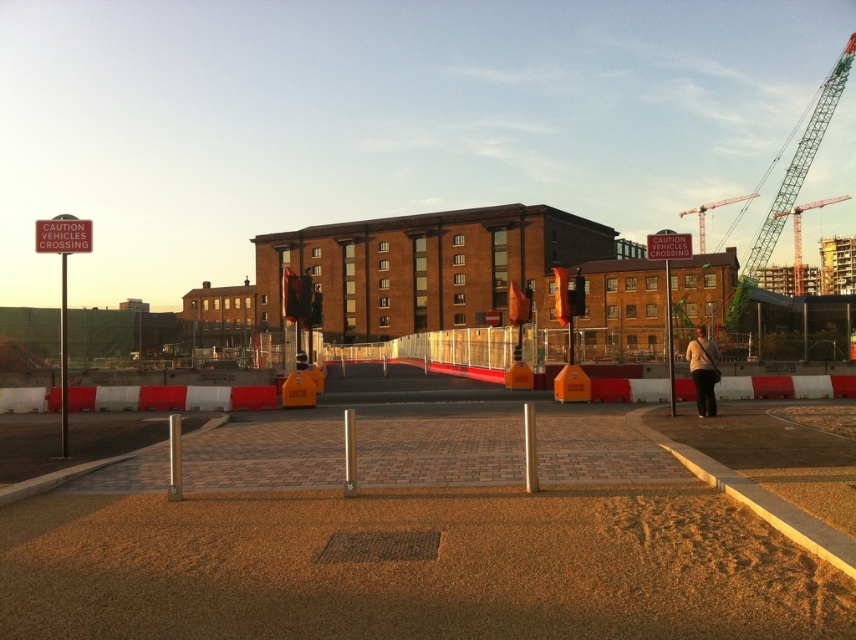
You are a pedestrian approaching the construction site. You see the green metal crane at upper right and the red plastic sign at upper left. Which object is positioned to the right side of the other?

The green metal crane at upper right is to the right of the red plastic sign at upper left.

You are a construction worker standing at the camera position. You need to reach the point marked at coordinates [698,324] as quickly as possible. Considering the construction site has a speed limit of 5 km per hour, how many minutes will it take you to walk there at a normal pace?

The distance between the point marked at coordinates [698,324] and the camera is 65.31 meters. Walking at a normal pace of approximately 5 km per hour, it would take roughly 1.57 minutes to cover that distance. Since the construction site has a 5 km per hour speed limit, you can reach the point in about 1.57 minutes.

You are a delivery driver who needs to enter the construction site. The site manager says you can only proceed if the green metal crane at upper right is taller than the red plastic sign at left. Based on the scene, can you enter?

The green metal crane at upper right has a greater height compared to the red plastic sign at left, so you can enter the construction site.